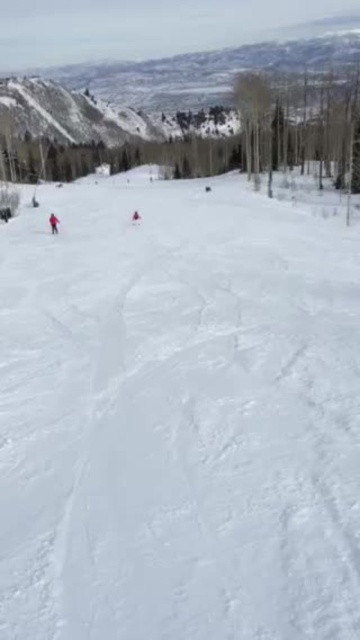
Question: Observing the image, what is the correct spatial positioning of white powdery snow at center in reference to matte red snowsuit at left?

Choices:
 (A) right
 (B) left

Answer: (A)

Question: Observing the image, what is the correct spatial positioning of white powdery snow at center in reference to matte red snowsuit at left?

Choices:
 (A) below
 (B) above

Answer: (A)

Question: Among these objects, which one is farthest from the camera?

Choices:
 (A) matte red snowsuit at left
 (B) white powdery snow at center

Answer: (A)

Question: Which of the following is the farthest from the observer?

Choices:
 (A) matte red snowsuit at left
 (B) white powdery snow at center

Answer: (A)

Question: Can you confirm if white powdery snow at center is wider than matte red snowsuit at left?

Choices:
 (A) no
 (B) yes

Answer: (B)